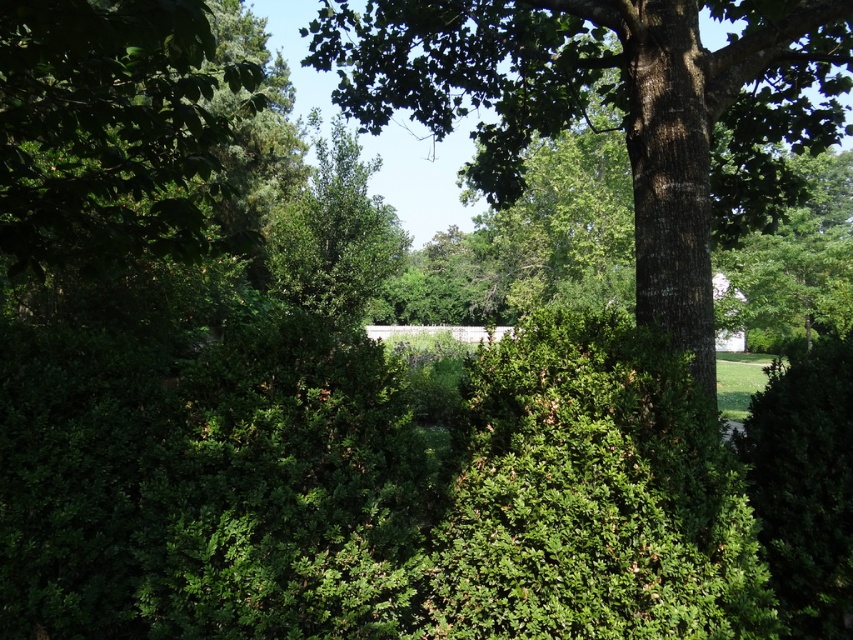
Question: Which point is closer to the camera?

Choices:
 (A) (44, 24)
 (B) (552, 40)

Answer: (A)

Question: Does green rough bark tree at center appear over green leafy tree at left?

Choices:
 (A) no
 (B) yes

Answer: (B)

Question: In this image, where is green rough bark tree at center located relative to green leafy tree at left?

Choices:
 (A) above
 (B) below

Answer: (A)

Question: Which point is closer to the camera taking this photo?

Choices:
 (A) (171, 68)
 (B) (448, 42)

Answer: (B)

Question: Considering the relative positions of green rough bark tree at center and green leafy tree at left in the image provided, where is green rough bark tree at center located with respect to green leafy tree at left?

Choices:
 (A) right
 (B) left

Answer: (A)